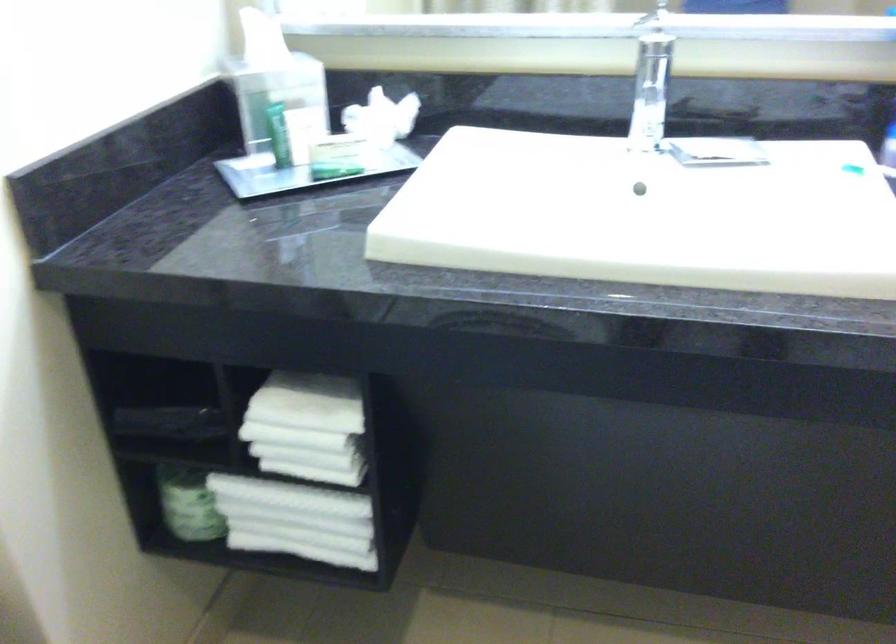
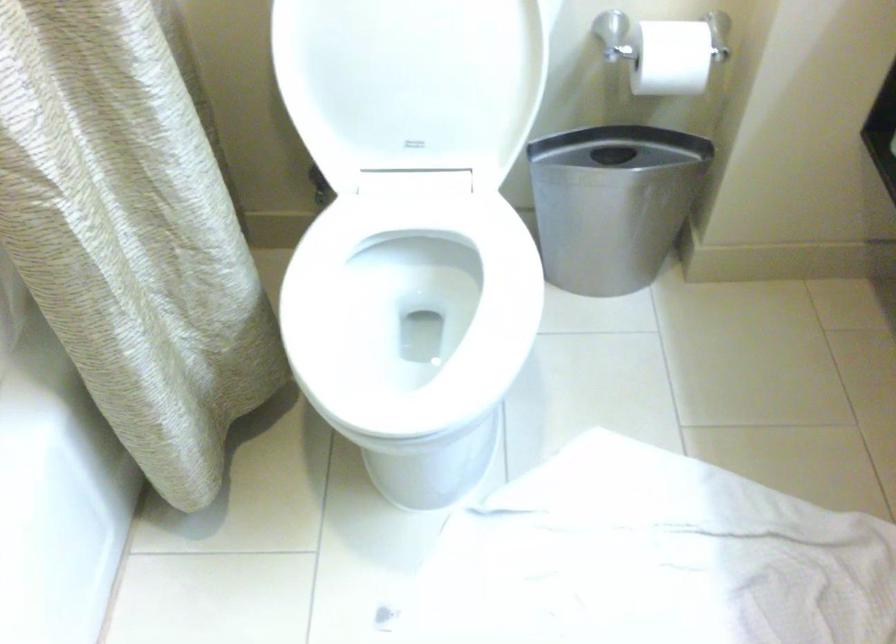
The images are taken continuously from a first-person perspective. In which direction is your viewpoint rotating?

The rotation direction of the camera is left-down.